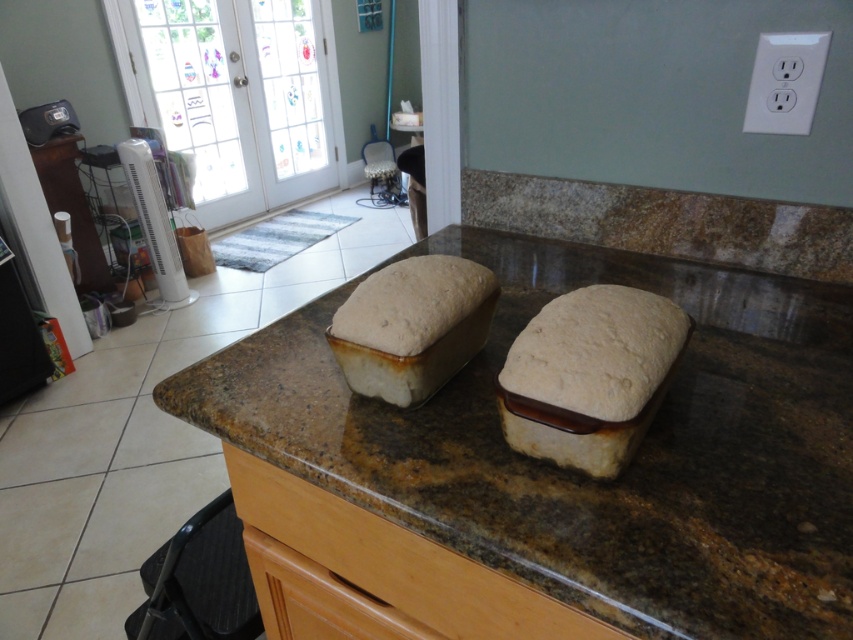
Question: Which of the following is the closest to the observer?

Choices:
 (A) spongy white bread at center
 (B) wooden drawer at center

Answer: (B)

Question: Can you confirm if brown granite countertop at center is bigger than spongy white bread at center?

Choices:
 (A) no
 (B) yes

Answer: (B)

Question: Estimate the real-world distances between objects in this image. Which object is closer to the spongy white bread at center?

Choices:
 (A) brown granite countertop at center
 (B) wooden drawer at center
 (C) matte ceramic loaf at center

Answer: (C)

Question: Which point is closer to the camera taking this photo?

Choices:
 (A) (461, 298)
 (B) (767, 362)
 (C) (637, 349)
 (D) (434, 557)

Answer: (C)

Question: Does spongy white bread at center lie in front of wooden drawer at center?

Choices:
 (A) yes
 (B) no

Answer: (B)

Question: Does brown granite countertop at center lie behind matte ceramic loaf at center?

Choices:
 (A) yes
 (B) no

Answer: (B)